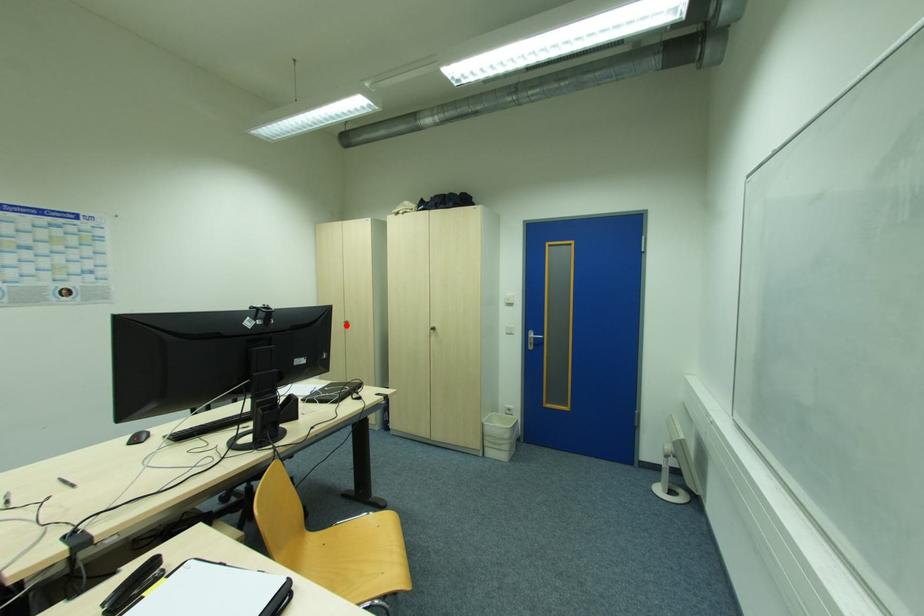
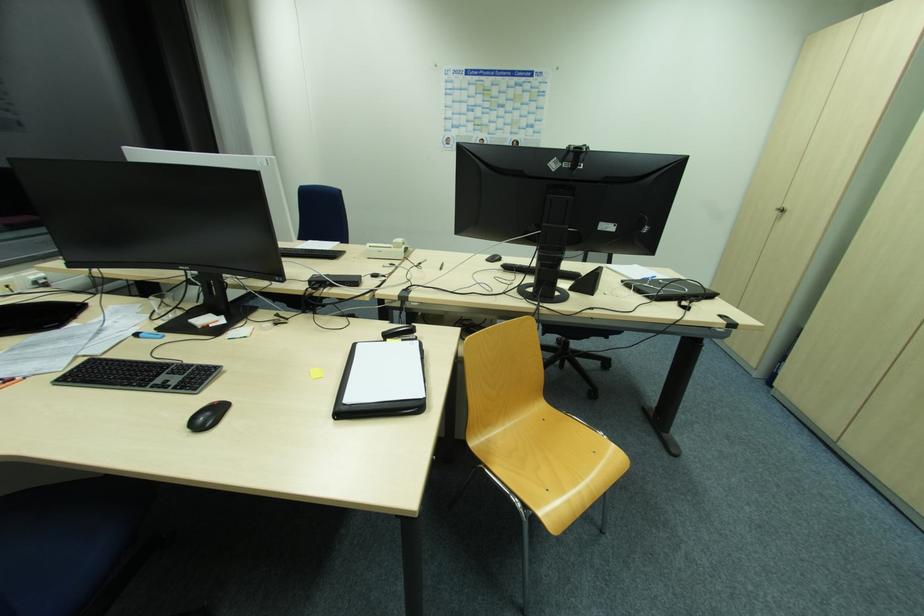
Find the pixel in the second image that matches the highlighted location in the first image.

(779, 214)